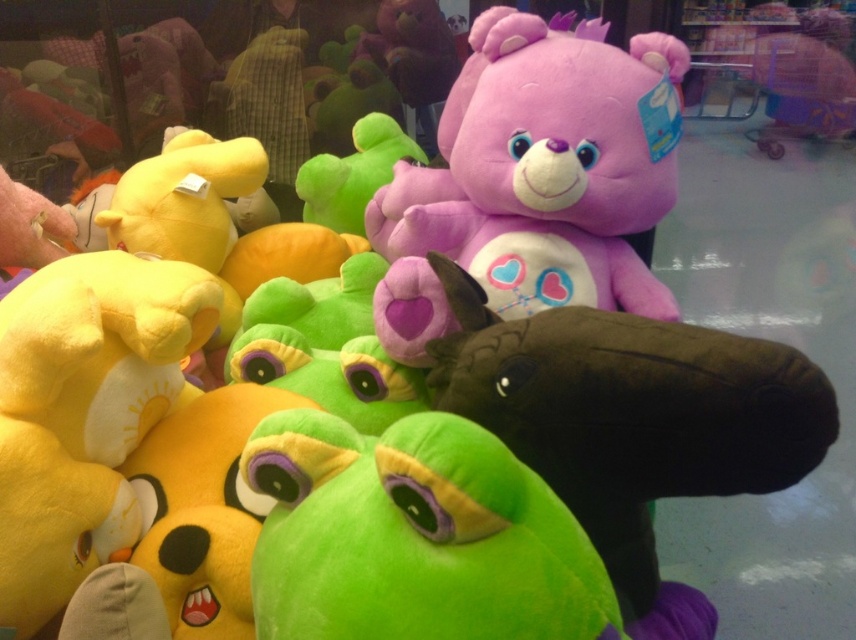
Is point (663, 144) positioned in front of point (557, 509)?

No, it is not.

Is purple plush bear at upper center below green plush toy at center?

No, purple plush bear at upper center is not below green plush toy at center.

Which is in front, point (623, 209) or point (418, 550)?

Point (418, 550) is more forward.

This screenshot has height=640, width=856. I want to click on purple plush bear at upper center, so click(x=535, y=179).

Can you confirm if purple plush bear at upper center is positioned to the left of dark brown plush horse at center?

Indeed, purple plush bear at upper center is positioned on the left side of dark brown plush horse at center.

Is purple plush bear at upper center wider than dark brown plush horse at center?

Yes, purple plush bear at upper center is wider than dark brown plush horse at center.

The width and height of the screenshot is (856, 640). I want to click on purple plush bear at upper center, so click(x=535, y=179).

Can you confirm if dark brown plush horse at center is positioned to the left of green plush toy at center?

In fact, dark brown plush horse at center is to the right of green plush toy at center.

Is point (741, 380) positioned after point (373, 557)?

Yes, it is behind point (373, 557).

Locate an element on the screen. The width and height of the screenshot is (856, 640). dark brown plush horse at center is located at coordinates (631, 417).